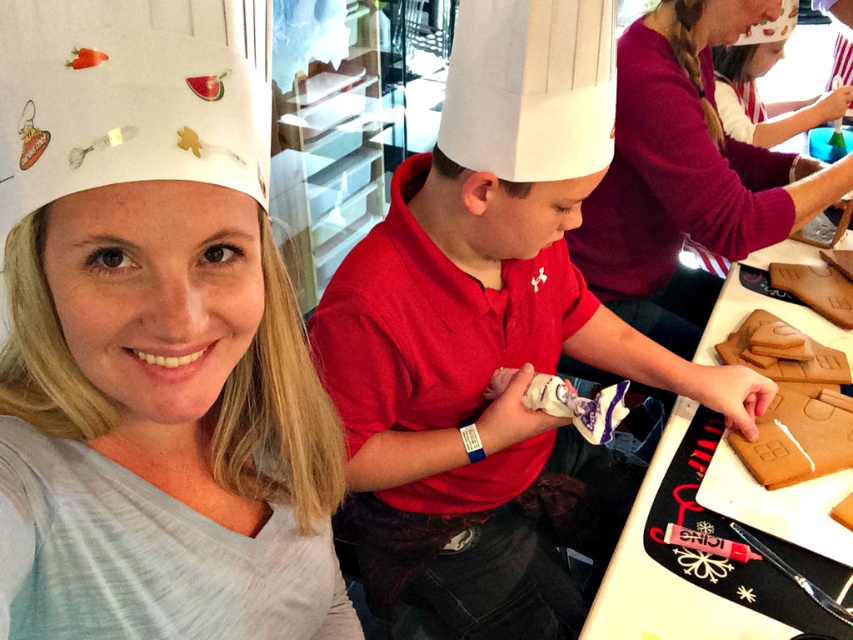
Is matte white chef hat at upper left to the right of brown matte gingerbread house at right from the viewer's perspective?

Incorrect, matte white chef hat at upper left is not on the right side of brown matte gingerbread house at right.

Does matte white chef hat at upper left have a lesser height compared to brown matte gingerbread house at right?

Incorrect, matte white chef hat at upper left's height does not fall short of brown matte gingerbread house at right's.

Who is more distant from viewer, (170, 596) or (785, 333)?

Point (785, 333)

The height and width of the screenshot is (640, 853). Identify the location of matte white chef hat at upper left. (157, 364).

Which is in front, point (339, 465) or point (821, 301)?

Positioned in front is point (339, 465).

Does matte white chef hat at upper left have a greater height compared to brown matte gingerbread house at center?

Yes, matte white chef hat at upper left is taller than brown matte gingerbread house at center.

Does point (277, 609) lie behind point (787, 266)?

No, (277, 609) is closer to viewer.

Where is `matte white chef hat at upper left`? This screenshot has height=640, width=853. matte white chef hat at upper left is located at coordinates (157, 364).

Does white frosted gingerbread house at center have a lesser height compared to brown matte gingerbread house at center?

Indeed, white frosted gingerbread house at center has a lesser height compared to brown matte gingerbread house at center.

Who is shorter, white frosted gingerbread house at center or brown matte gingerbread house at center?

white frosted gingerbread house at center

Is point (779, 420) less distant than point (801, 275)?

That is True.

At what (x,y) coordinates should I click in order to perform the action: click on white frosted gingerbread house at center. Please return your answer as a coordinate pair (x, y). This screenshot has height=640, width=853. Looking at the image, I should click on (798, 438).